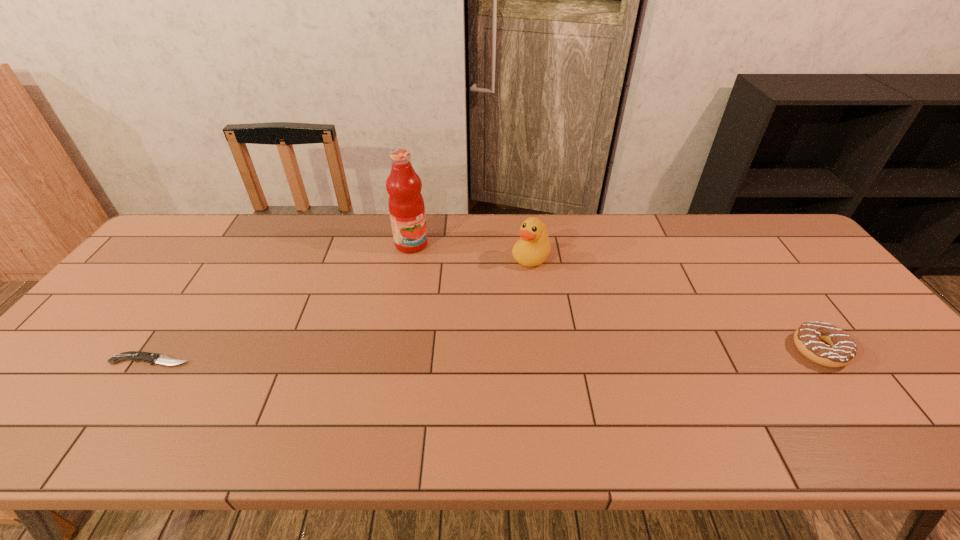
Find the location of `empty location between the doughnut and the third object from left to right`. empty location between the doughnut and the third object from left to right is located at coordinates (675, 303).

The image size is (960, 540). I want to click on empty space that is in between the fruit juice and the rightmost object, so click(x=615, y=297).

Where is `free space between the pocketknife and the fruit juice`? free space between the pocketknife and the fruit juice is located at coordinates (281, 302).

Find the location of a particular element. The height and width of the screenshot is (540, 960). vacant space that is in between the pocketknife and the third shortest object is located at coordinates (341, 309).

Locate an element on the screen. free point between the shortest object and the tallest object is located at coordinates (281, 302).

Locate an element on the screen. The height and width of the screenshot is (540, 960). object that can be found as the closest to the duck is located at coordinates click(x=406, y=205).

This screenshot has height=540, width=960. I want to click on the closest object relative to the doughnut, so click(x=533, y=248).

At what (x,y) coordinates should I click in order to perform the action: click on free space that satisfies the following two spatial constraints: 1. on the back side of the leftmost object; 2. on the right side of the rightmost object. Please return your answer as a coordinate pair (x, y). The width and height of the screenshot is (960, 540). Looking at the image, I should click on (158, 350).

Find the location of a particular element. This screenshot has width=960, height=540. free space that satisfies the following two spatial constraints: 1. on the front side of the fruit juice; 2. on the right side of the second shortest object is located at coordinates (392, 350).

This screenshot has height=540, width=960. What are the coordinates of `free point that satisfies the following two spatial constraints: 1. on the front side of the fruit juice; 2. on the right side of the second tallest object` in the screenshot? It's located at (409, 257).